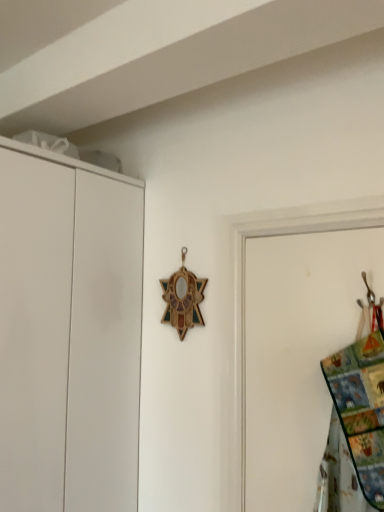
Question: From the image's perspective, relative to multicolored fabric at right, is white matte cupboard at left above or below?

Choices:
 (A) above
 (B) below

Answer: (B)

Question: From a real-world perspective, is white matte cupboard at left positioned above or below multicolored fabric at right?

Choices:
 (A) above
 (B) below

Answer: (A)

Question: Choose the correct answer: Is white matte cupboard at left inside multicolored fabric at right or outside it?

Choices:
 (A) inside
 (B) outside

Answer: (B)

Question: Considering the positions of multicolored fabric at right and white matte cupboard at left in the image, is multicolored fabric at right wider or thinner than white matte cupboard at left?

Choices:
 (A) thin
 (B) wide

Answer: (A)

Question: Considering the positions of multicolored fabric at right and white matte cupboard at left in the image, is multicolored fabric at right taller or shorter than white matte cupboard at left?

Choices:
 (A) tall
 (B) short

Answer: (B)

Question: Is multicolored fabric at right situated inside white matte cupboard at left or outside?

Choices:
 (A) inside
 (B) outside

Answer: (B)

Question: Visually, is multicolored fabric at right positioned to the left or to the right of white matte cupboard at left?

Choices:
 (A) left
 (B) right

Answer: (B)